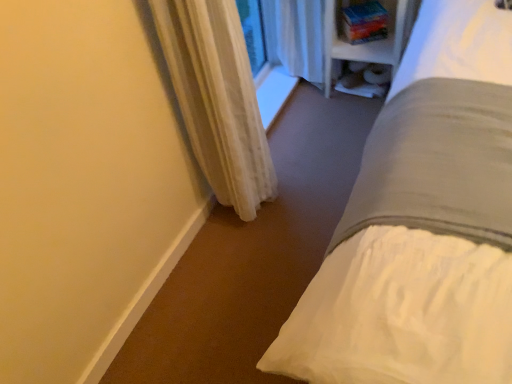
Question: Should I look upward or downward to see white sheer curtain at lower left?

Choices:
 (A) down
 (B) up

Answer: (B)

Question: From a real-world perspective, is white plastic bookshelf at upper right over white fabric shelf at upper right?

Choices:
 (A) yes
 (B) no

Answer: (A)

Question: Is white plastic bookshelf at upper right to the left of white fabric shelf at upper right from the viewer's perspective?

Choices:
 (A) yes
 (B) no

Answer: (A)

Question: Considering the relative sizes of white plastic bookshelf at upper right and white fabric shelf at upper right in the image provided, is white plastic bookshelf at upper right thinner than white fabric shelf at upper right?

Choices:
 (A) yes
 (B) no

Answer: (B)

Question: Considering the relative sizes of white plastic bookshelf at upper right and white fabric shelf at upper right in the image provided, is white plastic bookshelf at upper right taller than white fabric shelf at upper right?

Choices:
 (A) yes
 (B) no

Answer: (A)

Question: Is white plastic bookshelf at upper right positioned in front of white fabric shelf at upper right?

Choices:
 (A) no
 (B) yes

Answer: (B)

Question: Are white plastic bookshelf at upper right and white fabric shelf at upper right far apart?

Choices:
 (A) yes
 (B) no

Answer: (B)

Question: Considering the relative sizes of white plastic bookshelf at upper right and white sheer curtain at lower left in the image provided, is white plastic bookshelf at upper right thinner than white sheer curtain at lower left?

Choices:
 (A) yes
 (B) no

Answer: (B)

Question: Is white sheer curtain at lower left located within white plastic bookshelf at upper right?

Choices:
 (A) yes
 (B) no

Answer: (B)

Question: Can you confirm if white plastic bookshelf at upper right is wider than white sheer curtain at lower left?

Choices:
 (A) yes
 (B) no

Answer: (A)

Question: From a real-world perspective, is white plastic bookshelf at upper right located higher than white sheer curtain at lower left?

Choices:
 (A) no
 (B) yes

Answer: (A)

Question: Can you confirm if white plastic bookshelf at upper right is positioned to the left of white sheer curtain at lower left?

Choices:
 (A) yes
 (B) no

Answer: (B)

Question: Is white plastic bookshelf at upper right further to the viewer compared to white sheer curtain at lower left?

Choices:
 (A) no
 (B) yes

Answer: (B)

Question: From the image's perspective, is white sheer curtain at lower left beneath white fabric shelf at upper right?

Choices:
 (A) yes
 (B) no

Answer: (A)